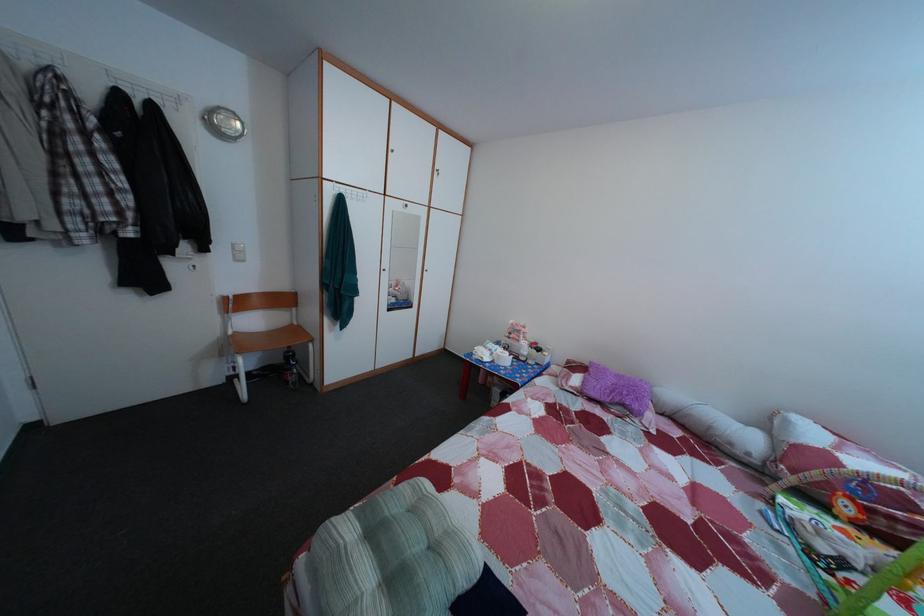
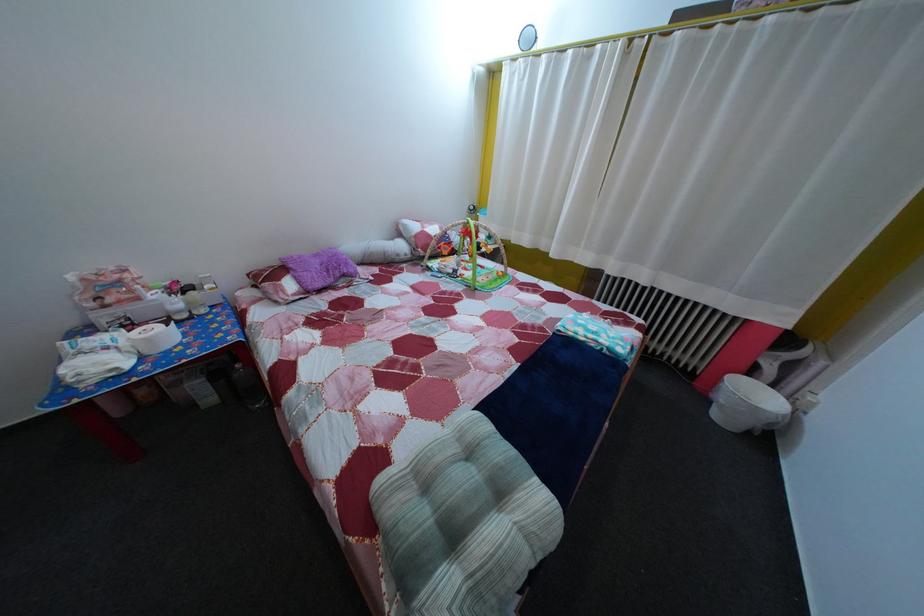
In the second image, find the point that corresponds to pixel 507 363 in the first image.

(157, 347)